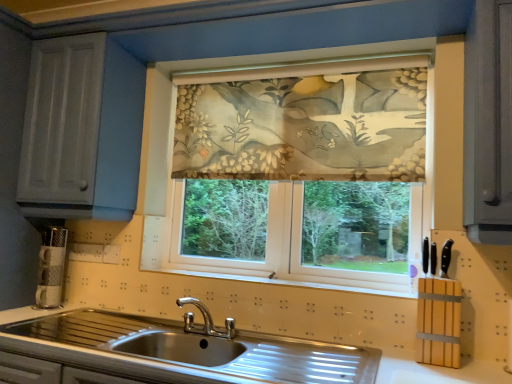
Measure the distance between point [366,82] and camera.

The distance of point [366,82] from camera is 6.06 feet.

Where is `stainless steel sink at lower center`? stainless steel sink at lower center is located at coordinates (195, 355).

The height and width of the screenshot is (384, 512). What do you see at coordinates (195, 355) in the screenshot?
I see `stainless steel sink at lower center` at bounding box center [195, 355].

I want to click on floral fabric at center, so click(x=301, y=167).

Which of these two, stainless steel sink at lower center or floral fabric at center, stands taller?

floral fabric at center.

Considering the relative sizes of stainless steel sink at lower center and floral fabric at center in the image provided, is stainless steel sink at lower center wider than floral fabric at center?

Yes, stainless steel sink at lower center is wider than floral fabric at center.

Is stainless steel sink at lower center facing away from floral fabric at center?

That's not correct — stainless steel sink at lower center is not looking away from floral fabric at center.

Are stainless steel sink at lower center and floral fabric at center beside each other?

No, stainless steel sink at lower center is not making contact with floral fabric at center.

Do you think stainless steel sink at lower center is within floral fabric curtain at center, or outside of it?

stainless steel sink at lower center is located beyond the bounds of floral fabric curtain at center.

Can you tell me how much stainless steel sink at lower center and floral fabric curtain at center differ in facing direction?

They differ by 0.00163 degrees in their facing directions.

Would you consider stainless steel sink at lower center to be distant from floral fabric curtain at center?

They are positioned close to each other.

Locate an element on the screen. countertop below the floral fabric curtain at center (from a real-world perspective) is located at coordinates (195, 355).

Is floral fabric at center completely or partially outside of stainless steel sink at lower center?

Indeed, floral fabric at center is completely outside stainless steel sink at lower center.

Considering the positions of objects floral fabric at center and stainless steel sink at lower center in the image provided, who is more to the right, floral fabric at center or stainless steel sink at lower center?

floral fabric at center.

Measure the distance between floral fabric at center and stainless steel sink at lower center.

floral fabric at center and stainless steel sink at lower center are 67.11 centimeters apart.

Considering the relative sizes of floral fabric at center and stainless steel sink at lower center in the image provided, is floral fabric at center shorter than stainless steel sink at lower center?

Incorrect, the height of floral fabric at center does not fall short of that of stainless steel sink at lower center.

Considering the relative sizes of floral fabric curtain at center and floral fabric at center in the image provided, is floral fabric curtain at center thinner than floral fabric at center?

Yes, floral fabric curtain at center is thinner than floral fabric at center.

Can you confirm if floral fabric curtain at center is taller than floral fabric at center?

Incorrect, the height of floral fabric curtain at center is not larger of that of floral fabric at center.

From a real-world perspective, is floral fabric curtain at center located higher than floral fabric at center?

Yes, from a real-world perspective, floral fabric curtain at center is on top of floral fabric at center.

Is floral fabric curtain at center with floral fabric at center?

Yes.

Which of these two, floral fabric at center or floral fabric curtain at center, is wider?

With larger width is floral fabric at center.

From the image's perspective, does floral fabric at center appear lower than floral fabric curtain at center?

Yes.

Measure the distance between floral fabric at center and floral fabric curtain at center.

The distance of floral fabric at center from floral fabric curtain at center is 3.19 inches.

Consider the image. Is floral fabric at center looking in the opposite direction of floral fabric curtain at center?

Yes, floral fabric at center's orientation is away from floral fabric curtain at center.

From a real-world perspective, which object rests below the other?

stainless steel sink at lower center, from a real-world perspective.

From the image's perspective, is floral fabric curtain at center above or below stainless steel sink at lower center?

floral fabric curtain at center is situated higher than stainless steel sink at lower center in the image.

Consider the image. Can you tell me how much floral fabric curtain at center and stainless steel sink at lower center differ in facing direction?

The angle between the facing direction of floral fabric curtain at center and the facing direction of stainless steel sink at lower center is 0.00163 degrees.

Is floral fabric curtain at center in contact with stainless steel sink at lower center?

No.

This screenshot has width=512, height=384. I want to click on window above the stainless steel sink at lower center (from the image's perspective), so click(x=301, y=167).

Where is `curtain located above the stainless steel sink at lower center (from a real-world perspective)`? curtain located above the stainless steel sink at lower center (from a real-world perspective) is located at coordinates (304, 128).

Estimate the real-world distances between objects in this image. Which object is closer to floral fabric at center, floral fabric curtain at center or stainless steel sink at lower center?

floral fabric curtain at center lies closer to floral fabric at center than the other object.

Based on their spatial positions, is stainless steel sink at lower center or floral fabric curtain at center further from floral fabric at center?

Based on the image, stainless steel sink at lower center appears to be further to floral fabric at center.

When comparing their distances from floral fabric curtain at center, does stainless steel sink at lower center or floral fabric at center seem further?

Based on the image, stainless steel sink at lower center appears to be further to floral fabric curtain at center.

Considering their positions, is floral fabric curtain at center positioned closer to stainless steel sink at lower center than floral fabric at center?

Among the two, floral fabric at center is located nearer to stainless steel sink at lower center.

Looking at the image, which one is located further to floral fabric curtain at center, floral fabric at center or stainless steel sink at lower center?

stainless steel sink at lower center lies further to floral fabric curtain at center than the other object.

Considering their positions, is floral fabric at center positioned further to stainless steel sink at lower center than floral fabric curtain at center?

floral fabric curtain at center is further to stainless steel sink at lower center.

Locate an element on the screen. The height and width of the screenshot is (384, 512). window that lies between floral fabric curtain at center and stainless steel sink at lower center from top to bottom is located at coordinates (301, 167).